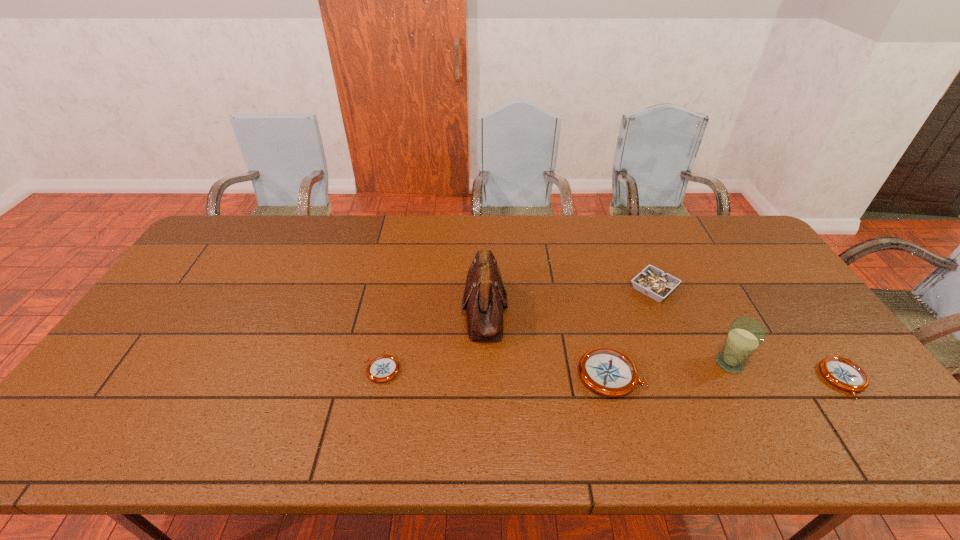
Image resolution: width=960 pixels, height=540 pixels. What are the coordinates of `free spot located on the left of the shortest compass` in the screenshot? It's located at (213, 370).

Locate an element on the screen. This screenshot has height=540, width=960. free space located on the left of the fourth object from right to left is located at coordinates pos(488,375).

The image size is (960, 540). Find the location of `vacant space located on the left of the fifth tallest object`. vacant space located on the left of the fifth tallest object is located at coordinates (716, 379).

Identify the location of blank area located on the right of the second object from left to right. Image resolution: width=960 pixels, height=540 pixels. (556, 309).

Where is `vacant region located on the left of the ashtray`? This screenshot has width=960, height=540. vacant region located on the left of the ashtray is located at coordinates (584, 288).

You are a GUI agent. You are given a task and a screenshot of the screen. Output one action in this format:
    pyautogui.click(x=<x>, y=<y>)
    Task: Click on the vacant space located on the back of the glass
    
    Given the screenshot: What is the action you would take?
    click(x=700, y=305)

This screenshot has height=540, width=960. Identify the location of object at the right edge. (841, 372).

What are the coordinates of `object present at the near right corner` in the screenshot? It's located at (841, 372).

Find the location of a particular element. The image size is (960, 540). free space at the far edge of the desktop is located at coordinates (633, 215).

This screenshot has height=540, width=960. Identify the location of free region at the near edge. (492, 393).